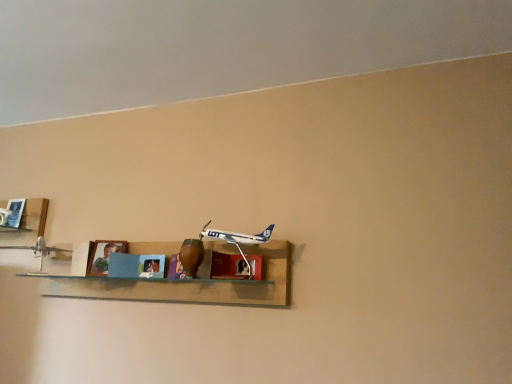
Question: Considering the positions of matte wood cabinet at center and metallic silver airplane at left, which is the 2th toy from right to left, in the image, is matte wood cabinet at center taller or shorter than metallic silver airplane at left, which is the 2th toy from right to left,?

Choices:
 (A) short
 (B) tall

Answer: (A)

Question: Visually, is matte wood cabinet at center positioned to the left or to the right of metallic silver airplane at left, which is the 2th toy from right to left?

Choices:
 (A) right
 (B) left

Answer: (A)

Question: Which of these objects is positioned closest to the white plastic airplane at center, arranged as the 2th toy when viewed from the back?

Choices:
 (A) matte wood cabinet at center
 (B) wooden shelf at center, the second shelf viewed from the left
 (C) metallic silver airplane at left, which is the 2th toy in front-to-back order
 (D) wooden shelf at left, the 1th shelf when ordered from left to right
 (E) blue matte picture frame at center

Answer: (A)

Question: Estimate the real-world distances between objects in this image. Which object is closer to the matte wood cabinet at center?

Choices:
 (A) white plastic airplane at center, acting as the 1th toy starting from the front
 (B) wooden shelf at center, the first shelf viewed from the right
 (C) metallic silver airplane at left, which is the 2th toy from right to left
 (D) wooden shelf at left, the 1th shelf when ordered from left to right
 (E) blue matte picture frame at center

Answer: (A)